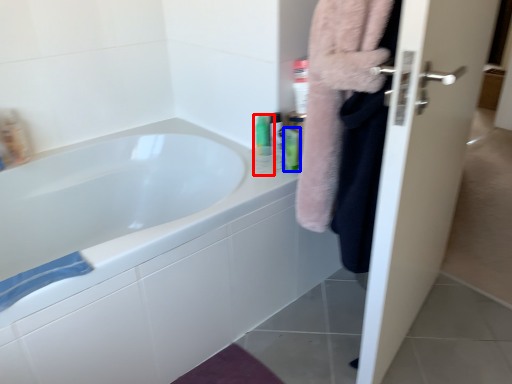
Question: Which point is further to the camera, mouthwash (highlighted by a red box) or mouthwash (highlighted by a blue box)?

Choices:
 (A) mouthwash
 (B) mouthwash

Answer: (A)